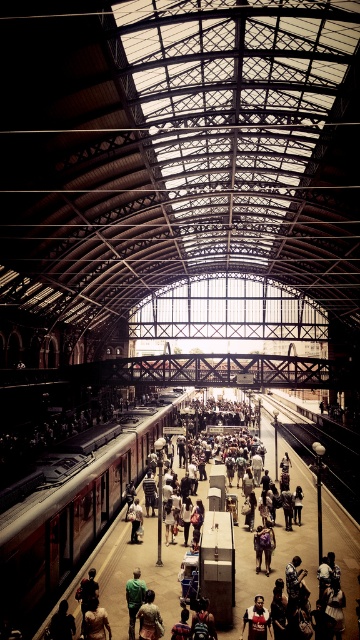
Is dark brown leather jacket at center to the right of brown leather jacket at center from the viewer's perspective?

Indeed, dark brown leather jacket at center is positioned on the right side of brown leather jacket at center.

Can you confirm if dark brown leather jacket at center is bigger than brown leather jacket at center?

Yes, dark brown leather jacket at center is bigger than brown leather jacket at center.

Locate an element on the screen. Image resolution: width=360 pixels, height=640 pixels. dark brown leather jacket at center is located at coordinates (257, 620).

I want to click on dark brown leather jacket at center, so click(x=257, y=620).

Which of these two, metal train track at center or leather jacket at center, stands taller?

metal train track at center is taller.

Does point (293, 417) come in front of point (87, 612)?

No, it is not.

In order to click on metal train track at center in this screenshot , I will do `click(324, 456)`.

Who is taller, leather jacket at center or green fabric shirt at center?

green fabric shirt at center is taller.

Who is more forward, (87, 634) or (132, 572)?

Point (87, 634)

Image resolution: width=360 pixels, height=640 pixels. I want to click on leather jacket at center, so click(x=95, y=620).